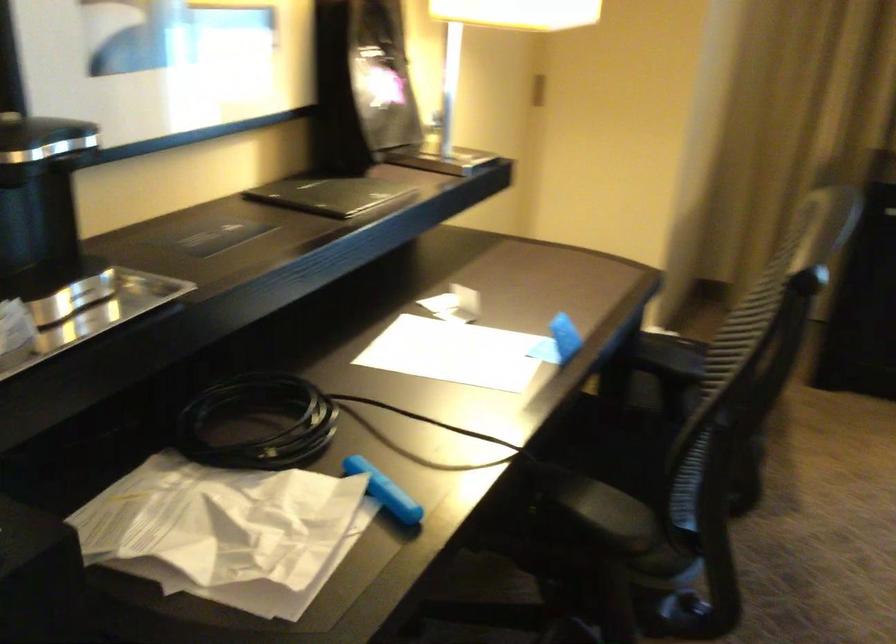
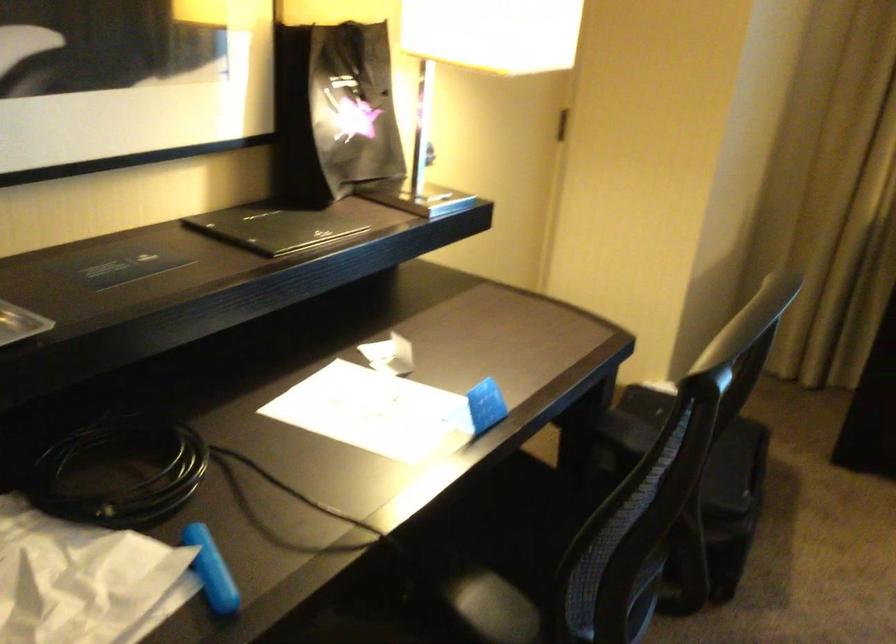
The point at (367, 78) is marked in the first image. Where is the corresponding point in the second image?

(334, 111)